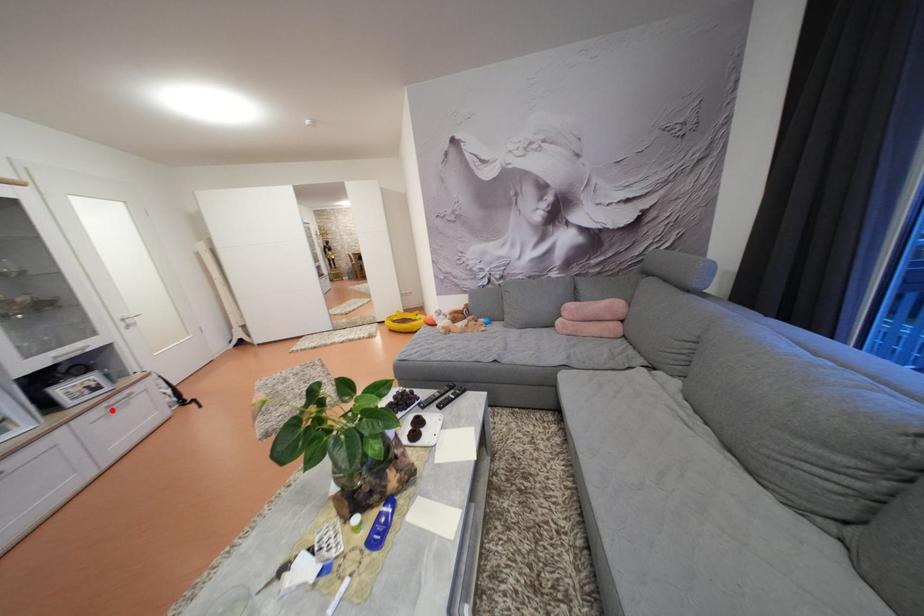
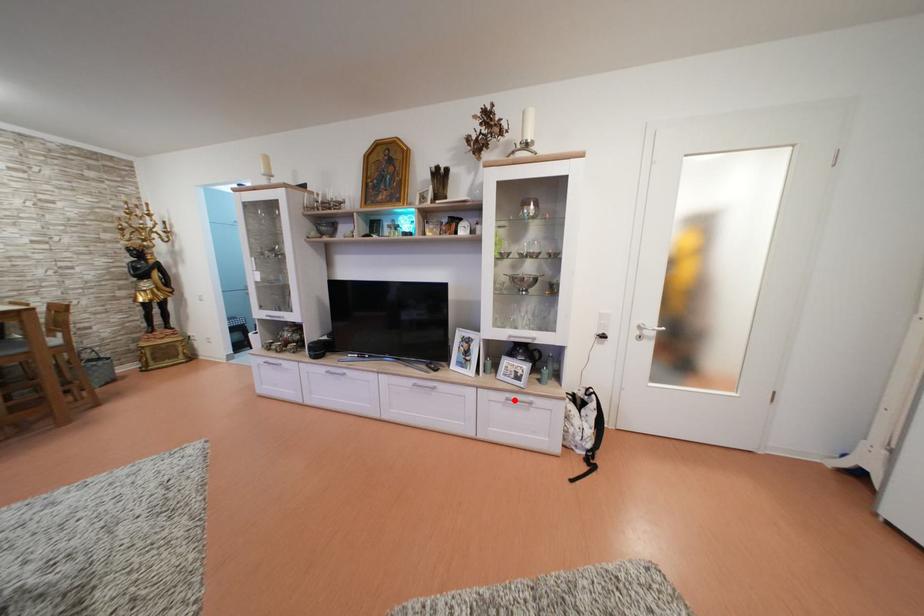
I am providing you with two images of the same scene from different viewpoints. A red point is marked on the first image and another point is marked on the second image. Do the highlighted points in image1 and image2 indicate the same real-world spot?

Yes